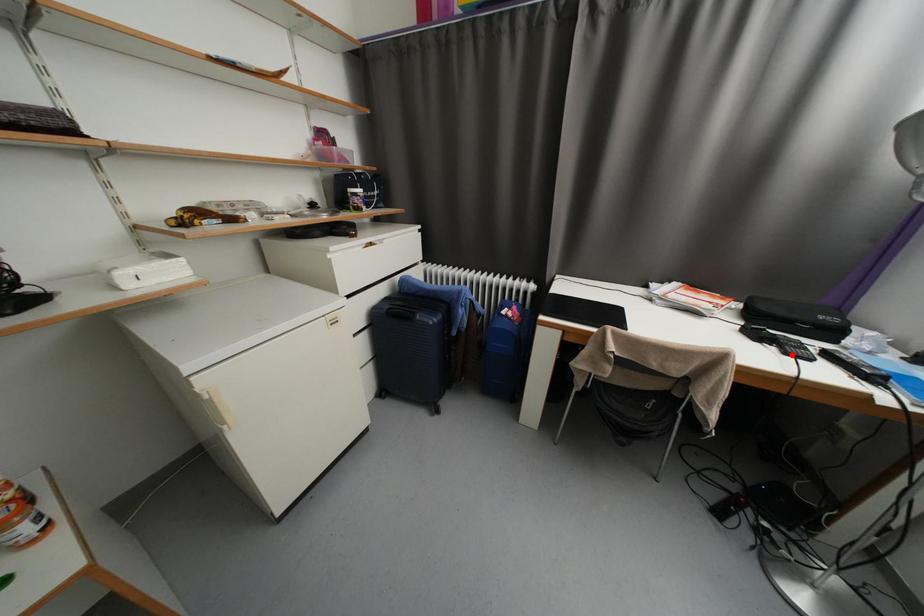
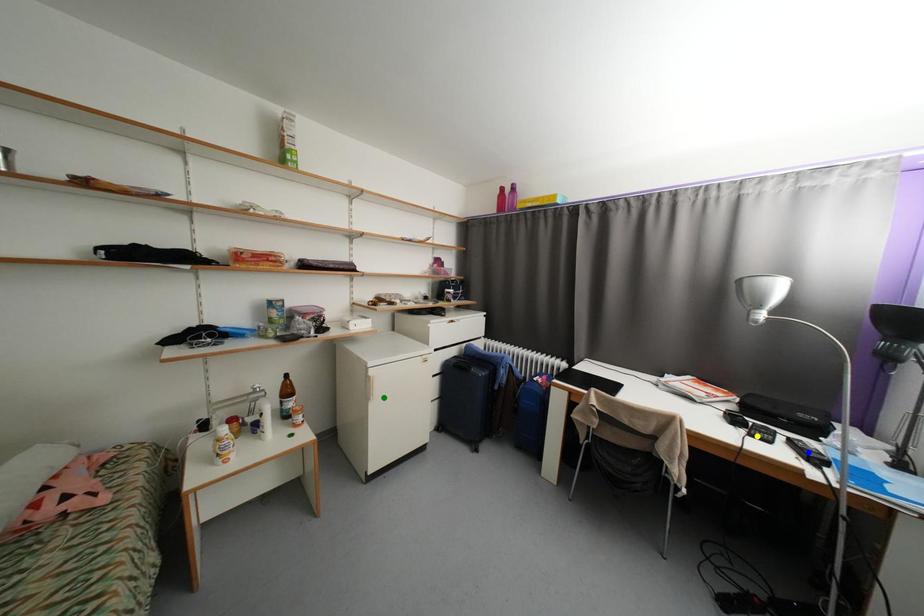
Question: I am providing you with two images of the same scene from different viewpoints. A red point is marked on the first image. You are given multiple points on the second image. Which mark in image 2 goes with the point in image 1?

Choices:
 (A) blue point
 (B) yellow point
 (C) green point

Answer: (B)